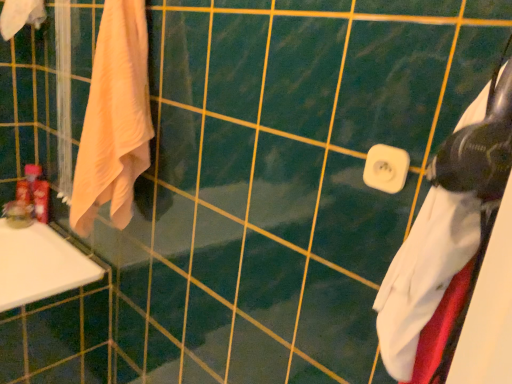
Question: Is point (45, 190) positioned closer to the camera than point (34, 205)?

Choices:
 (A) closer
 (B) farther

Answer: (A)

Question: Considering the positions of matte plastic toothpaste tube at left, the 2th toiletry in the left-to-right sequence, and matte plastic toiletries at left, acting as the 2th toiletry starting from the right, in the image, is matte plastic toothpaste tube at left, the 2th toiletry in the left-to-right sequence, bigger or smaller than matte plastic toiletries at left, acting as the 2th toiletry starting from the right,?

Choices:
 (A) small
 (B) big

Answer: (B)

Question: Considering the real-world distances, which object is closest to the matte plastic toiletries at left, the first toiletry positioned from the left?

Choices:
 (A) matte plastic toothpaste tube at left, the 2th toiletry in the left-to-right sequence
 (B) white matte towel at right, positioned as the 1th towel in right-to-left order
 (C) light peach cotton towel at left, the second towel when ordered from front to back
 (D) white plastic towel bar at center
 (E) beige cotton towel at upper left, which appears as the 1th towel when viewed from the back

Answer: (A)

Question: Which object is the farthest from the beige cotton towel at upper left, placed as the 1th towel when sorted from left to right?

Choices:
 (A) white matte towel at right, which appears as the 3th towel when viewed from the left
 (B) light peach cotton towel at left, which appears as the second towel when viewed from the left
 (C) white plastic towel bar at center
 (D) matte plastic toothpaste tube at left, positioned as the first toiletry in right-to-left order
 (E) matte plastic toiletries at left, the first toiletry positioned from the left

Answer: (A)